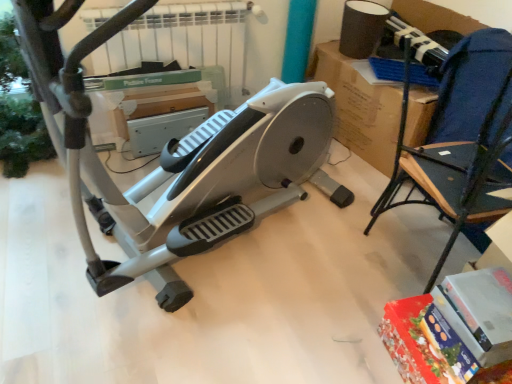
Question: Based on their sizes in the image, would you say blue fabric chair at right is bigger or smaller than silver/grey plastic stationary bicycle at center?

Choices:
 (A) big
 (B) small

Answer: (B)

Question: Which is correct: blue fabric chair at right is inside silver/grey plastic stationary bicycle at center, or outside of it?

Choices:
 (A) inside
 (B) outside

Answer: (B)

Question: Considering the positions of blue fabric chair at right and silver/grey plastic stationary bicycle at center in the image, is blue fabric chair at right wider or thinner than silver/grey plastic stationary bicycle at center?

Choices:
 (A) wide
 (B) thin

Answer: (B)

Question: Is silver/grey plastic stationary bicycle at center in front of or behind blue fabric chair at right in the image?

Choices:
 (A) behind
 (B) front

Answer: (B)

Question: Do you think silver/grey plastic stationary bicycle at center is within blue fabric chair at right, or outside of it?

Choices:
 (A) outside
 (B) inside

Answer: (A)

Question: From the image's perspective, is silver/grey plastic stationary bicycle at center positioned above or below blue fabric chair at right?

Choices:
 (A) above
 (B) below

Answer: (A)

Question: Is point (69, 109) positioned closer to the camera than point (496, 160)?

Choices:
 (A) farther
 (B) closer

Answer: (B)